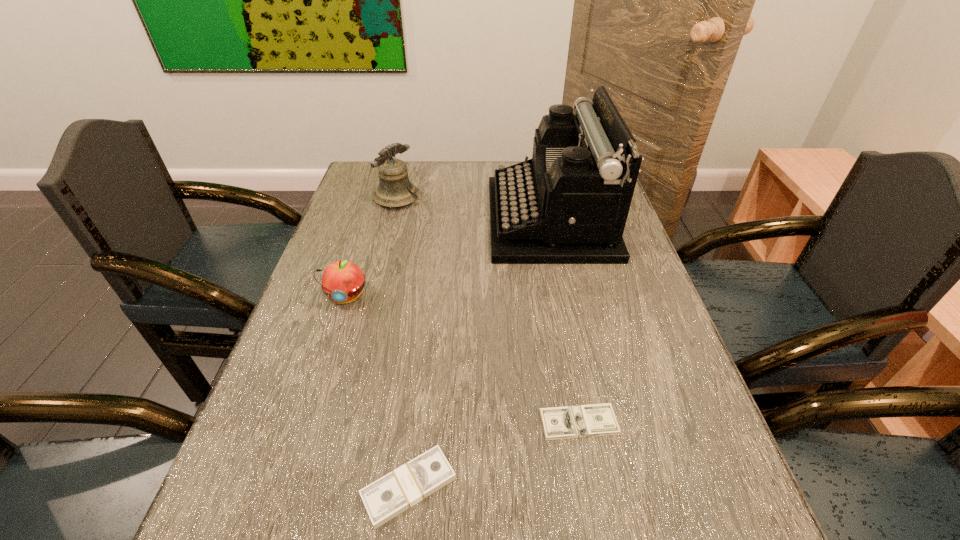
Where is `vacant space situated 0.300m on the typing side of the tallest object`? The image size is (960, 540). vacant space situated 0.300m on the typing side of the tallest object is located at coordinates (389, 219).

At what (x,y) coordinates should I click in order to perform the action: click on vacant space located 0.400m on the front of the fourth shortest object. Please return your answer as a coordinate pair (x, y). This screenshot has height=540, width=960. Looking at the image, I should click on (369, 307).

Where is `vacant space situated on the back of the apple`? vacant space situated on the back of the apple is located at coordinates (357, 259).

You are a GUI agent. You are given a task and a screenshot of the screen. Output one action in this format:
    pyautogui.click(x=<x>, y=<y>)
    Task: Click on the vacant point located on the right of the nearest object
    This screenshot has height=540, width=960.
    Given the screenshot: What is the action you would take?
    pyautogui.click(x=570, y=487)

The width and height of the screenshot is (960, 540). I want to click on free space located on the back of the right dollar, so click(552, 277).

You are a GUI agent. You are given a task and a screenshot of the screen. Output one action in this format:
    pyautogui.click(x=<x>, y=<y>)
    Task: Click on the typewriter positioned at the far edge
    
    Given the screenshot: What is the action you would take?
    pyautogui.click(x=569, y=204)

The height and width of the screenshot is (540, 960). Find the location of `bell that is at the far edge`. bell that is at the far edge is located at coordinates (394, 190).

Identify the location of bell that is at the left edge. (394, 190).

At what (x,y) coordinates should I click in order to perform the action: click on apple present at the left edge. Please return your answer as a coordinate pair (x, y). Looking at the image, I should click on (342, 281).

Find the location of `object present at the right edge`. object present at the right edge is located at coordinates (569, 204).